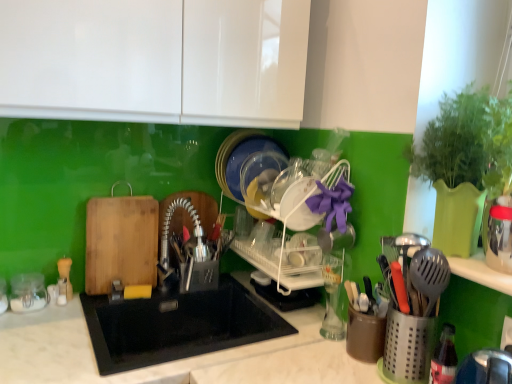
Question: Can we say black matte sink at center lies outside clear glass jar at left?

Choices:
 (A) no
 (B) yes

Answer: (B)

Question: Does black matte sink at center touch clear glass jar at left?

Choices:
 (A) yes
 (B) no

Answer: (B)

Question: Is black matte sink at center to the right of clear glass jar at left from the viewer's perspective?

Choices:
 (A) no
 (B) yes

Answer: (B)

Question: Is black matte sink at center positioned in front of clear glass jar at left?

Choices:
 (A) no
 (B) yes

Answer: (B)

Question: From a real-world perspective, is black matte sink at center beneath clear glass jar at left?

Choices:
 (A) yes
 (B) no

Answer: (A)

Question: Is clear glass jar at left in front of or behind white plastic dish rack at center in the image?

Choices:
 (A) front
 (B) behind

Answer: (B)

Question: Based on their sizes in the image, would you say clear glass jar at left is bigger or smaller than white plastic dish rack at center?

Choices:
 (A) big
 (B) small

Answer: (B)

Question: Is clear glass jar at left wider or thinner than white plastic dish rack at center?

Choices:
 (A) wide
 (B) thin

Answer: (B)

Question: From the image's perspective, is clear glass jar at left located above or below white plastic dish rack at center?

Choices:
 (A) below
 (B) above

Answer: (A)

Question: From the image's perspective, is white plastic dish rack at center located above or below clear glass jar at left?

Choices:
 (A) above
 (B) below

Answer: (A)

Question: Is white plastic dish rack at center wider or thinner than clear glass jar at left?

Choices:
 (A) thin
 (B) wide

Answer: (B)

Question: Is white plastic dish rack at center taller or shorter than clear glass jar at left?

Choices:
 (A) short
 (B) tall

Answer: (B)

Question: Does point (244, 163) appear closer or farther from the camera than point (10, 301)?

Choices:
 (A) closer
 (B) farther

Answer: (B)

Question: Is clear glass jar at left taller or shorter than black matte sink at center?

Choices:
 (A) tall
 (B) short

Answer: (B)

Question: From the image's perspective, is clear glass jar at left above or below black matte sink at center?

Choices:
 (A) below
 (B) above

Answer: (B)